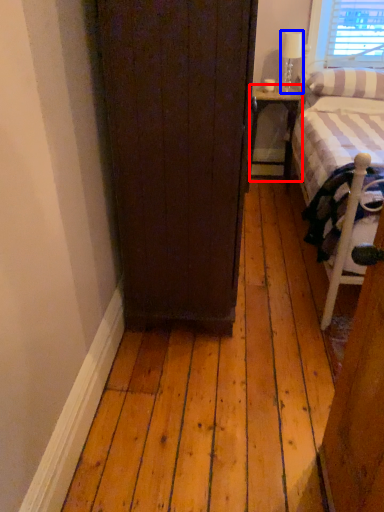
Question: Among these objects, which one is farthest to the camera, nightstand (highlighted by a red box) or lamp (highlighted by a blue box)?

Choices:
 (A) nightstand
 (B) lamp

Answer: (A)